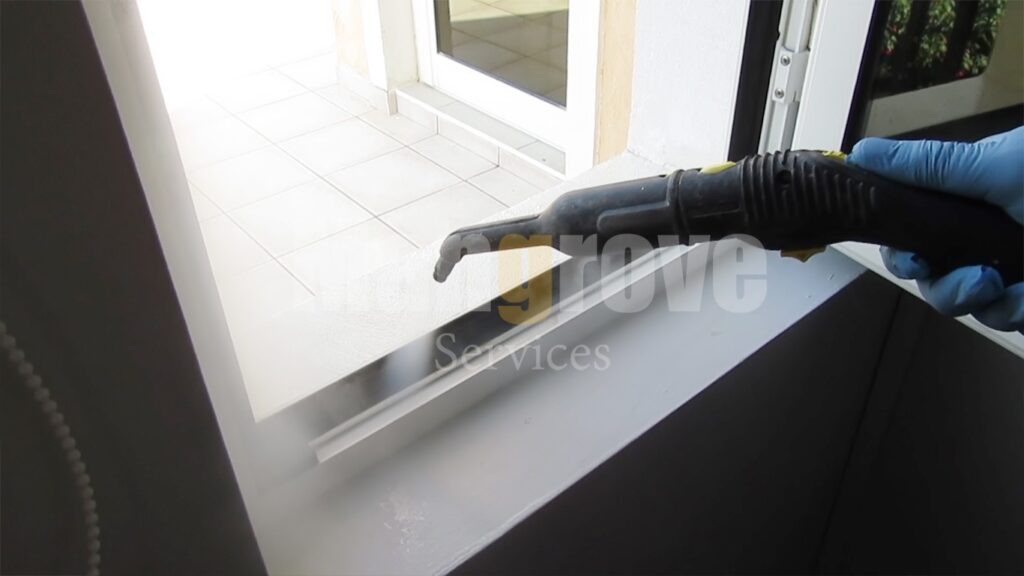
At what (x,y) coordinates should I click in order to perform the action: click on unpainted door frame. Please return your answer as a coordinate pair (x, y). Image resolution: width=1024 pixels, height=576 pixels. Looking at the image, I should click on (612, 127).